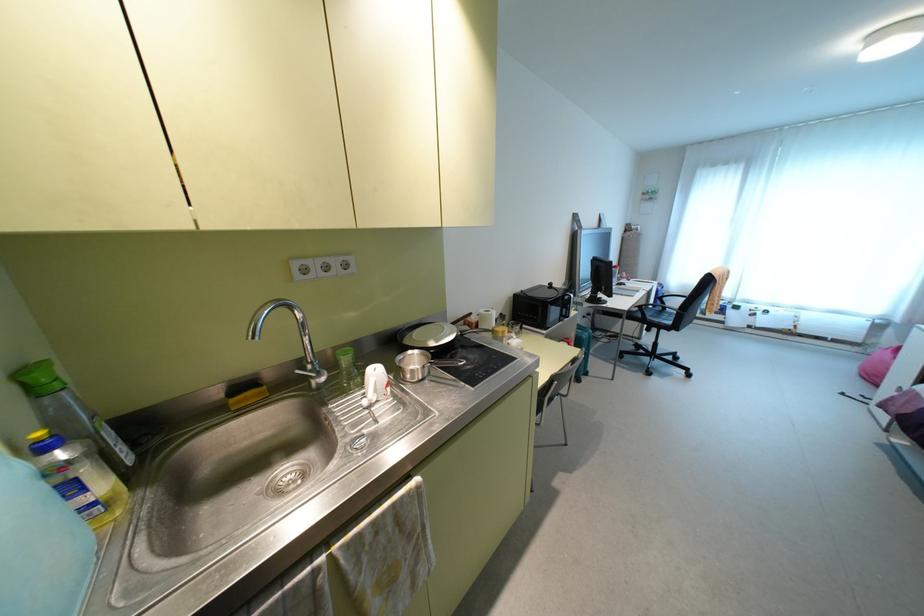
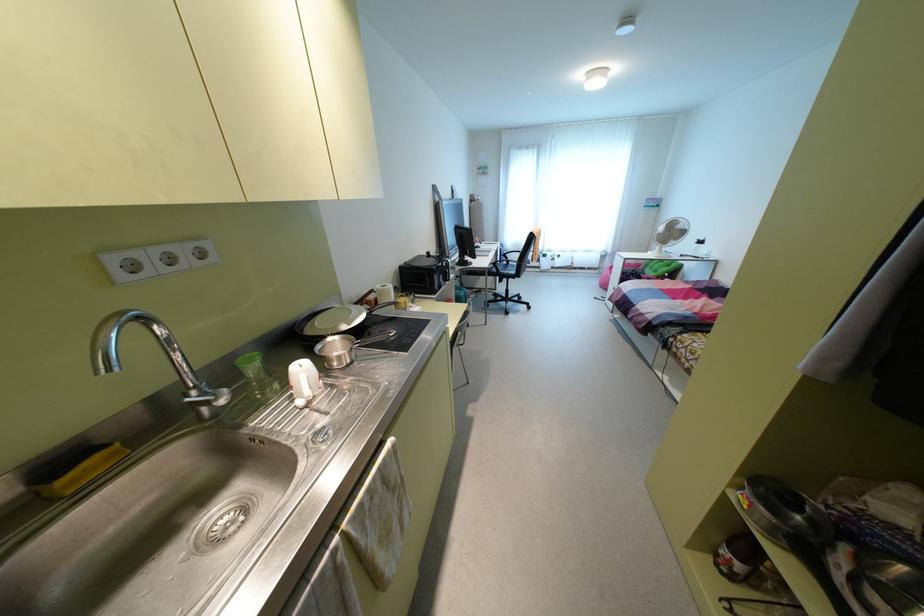
In the second image, find the point that corresponds to pixel 638 306 in the first image.

(493, 262)